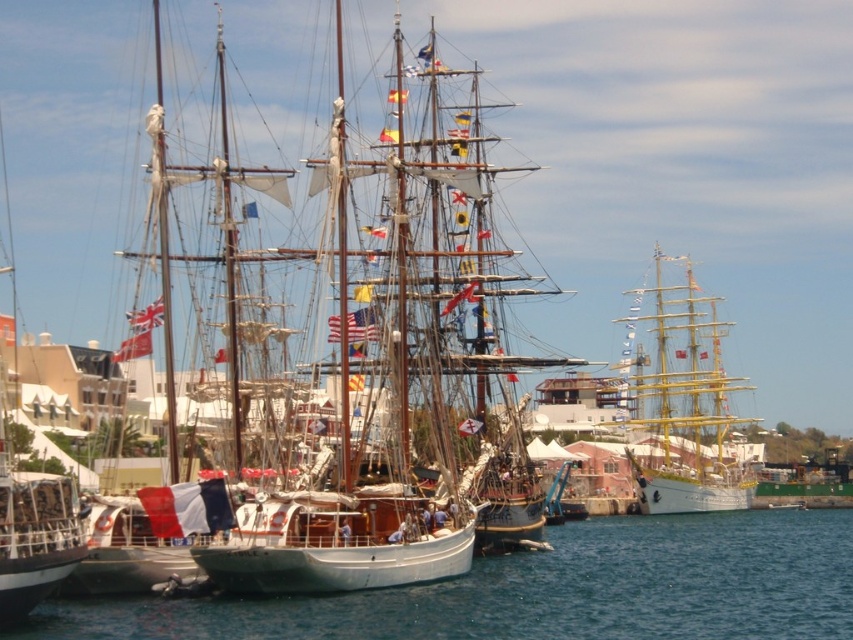
Question: Is wooden ship at center smaller than yellow polished wood sailboat at right?

Choices:
 (A) no
 (B) yes

Answer: (A)

Question: Is the position of wooden ship at center less distant than that of yellow polished wood sailboat at right?

Choices:
 (A) yes
 (B) no

Answer: (A)

Question: Which of these objects is positioned farthest from the wooden ship at center?

Choices:
 (A) clear blue water at center
 (B) yellow polished wood sailboat at right

Answer: (B)

Question: Which object is farther from the camera taking this photo?

Choices:
 (A) yellow polished wood sailboat at right
 (B) wooden ship at center

Answer: (A)

Question: Can you confirm if clear blue water at center is positioned below yellow polished wood sailboat at right?

Choices:
 (A) yes
 (B) no

Answer: (A)

Question: Which of these objects is positioned farthest from the clear blue water at center?

Choices:
 (A) wooden ship at center
 (B) yellow polished wood sailboat at right

Answer: (B)